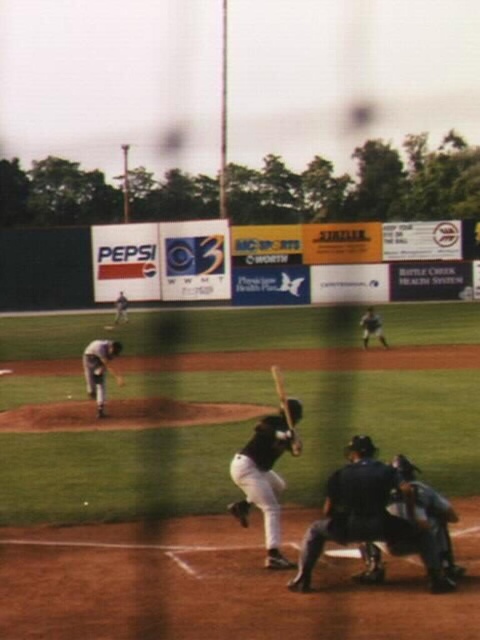
Question: Does dark blue leather catcher at lower center appear on the left side of dark blue uniform at right?

Choices:
 (A) no
 (B) yes

Answer: (B)

Question: Does wooden baseball bat at center have a larger size compared to dark brown leather glove at lower center?

Choices:
 (A) yes
 (B) no

Answer: (A)

Question: Among these objects, which one is nearest to the camera?

Choices:
 (A) dark blue uniform at upper left
 (B) wooden baseball bat at center
 (C) black matte bat at center

Answer: (C)

Question: Which point is farther to the camera?

Choices:
 (A) (368, 323)
 (B) (245, 500)

Answer: (A)

Question: Which object is positioned farthest from the wooden baseball bat at center?

Choices:
 (A) gray uniformed man at left
 (B) black matte bat at center
 (C) dark blue leather catcher at lower center
 (D) dark blue uniform at upper left

Answer: (D)

Question: Is gray uniformed man at left positioned at the back of dark brown leather glove at lower center?

Choices:
 (A) yes
 (B) no

Answer: (A)